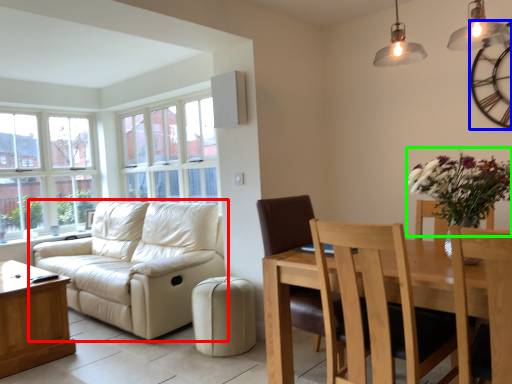
Question: Based on their relative distances, which object is nearer to studio couch (highlighted by a red box)? Choose from clock (highlighted by a blue box) and floral arrangement (highlighted by a green box).

Choices:
 (A) clock
 (B) floral arrangement

Answer: (B)